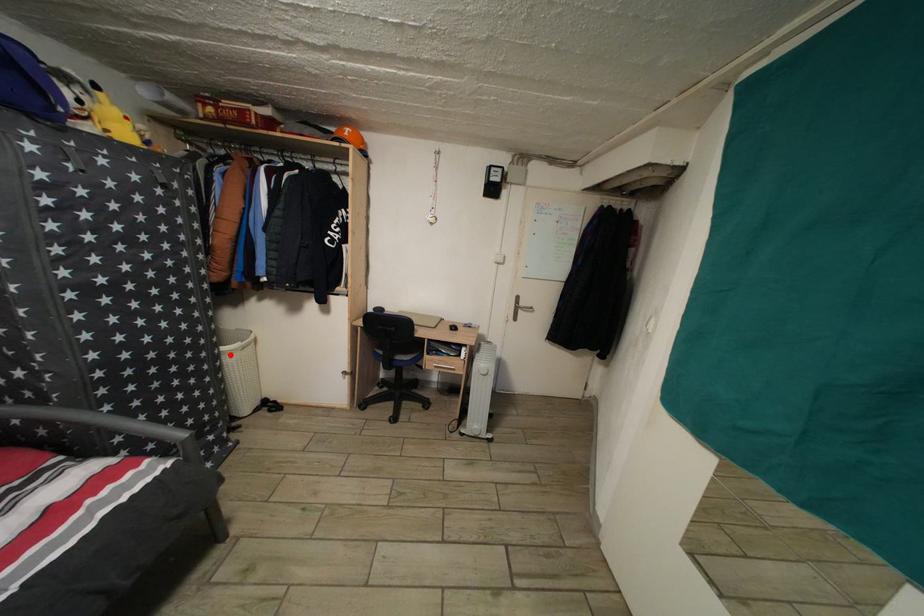
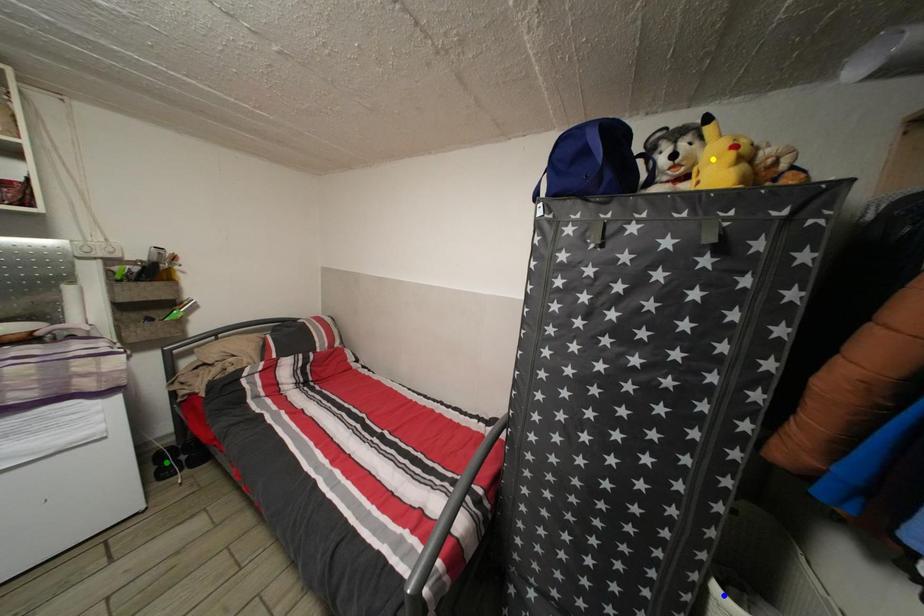
Question: I am providing you with two images of the same scene from different viewpoints. A red point is marked on the first image. You are given multiple points on the second image. Which mark in image 2 goes with the point in image 1?

Choices:
 (A) blue point
 (B) green point
 (C) yellow point

Answer: (A)